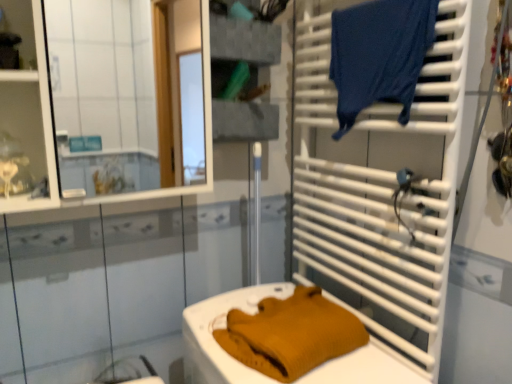
The image size is (512, 384). What do you see at coordinates (221, 328) in the screenshot?
I see `mustard knit sweater at lower center` at bounding box center [221, 328].

In order to click on white plastic towel rack at right in this screenshot , I will do `click(378, 190)`.

Image resolution: width=512 pixels, height=384 pixels. What do you see at coordinates (378, 190) in the screenshot? I see `white plastic towel rack at right` at bounding box center [378, 190].

The image size is (512, 384). Find the location of `matte white shelf at upper left, placed as the 2th shelf when sorted from right to left`. matte white shelf at upper left, placed as the 2th shelf when sorted from right to left is located at coordinates (20, 29).

Is dark blue fabric at upper right with mustard knit sweater at lower center?

No, dark blue fabric at upper right is not in contact with mustard knit sweater at lower center.

In the scene shown: From the image's perspective, who appears lower, dark blue fabric at upper right or mustard knit sweater at lower center?

mustard knit sweater at lower center, from the image's perspective.

Can you tell me how much dark blue fabric at upper right and mustard knit sweater at lower center differ in facing direction?

90 degrees.

Are white glossy mirror at upper left and mustard knit sweater at lower center located far from each other?

white glossy mirror at upper left is far away from mustard knit sweater at lower center.

Which object is wider, white glossy mirror at upper left or mustard knit sweater at lower center?

mustard knit sweater at lower center is wider.

There is a mustard knit sweater at lower center. Identify the location of mirror above it (from a real-world perspective). 131,96.

Which is correct: white plastic towel rack at right is inside dark blue fabric at upper right, or outside of it?

white plastic towel rack at right is not enclosed by dark blue fabric at upper right.

Can you confirm if white plastic towel rack at right is wider than dark blue fabric at upper right?

No.

Which object is further away from the camera, white plastic towel rack at right or dark blue fabric at upper right?

dark blue fabric at upper right is further from the camera.

Does textured gray fabric at upper center, marked as the 1th shelf in a back-to-front arrangement, have a lesser width compared to mustard knit sweater at lower center?

Correct, the width of textured gray fabric at upper center, marked as the 1th shelf in a back-to-front arrangement, is less than that of mustard knit sweater at lower center.

From the image's perspective, relative to mustard knit sweater at lower center, is textured gray fabric at upper center, positioned as the second shelf in front-to-back order, above or below?

Based on their image positions, textured gray fabric at upper center, positioned as the second shelf in front-to-back order, is located above mustard knit sweater at lower center.

In the scene shown: Which of these two, textured gray fabric at upper center, positioned as the second shelf in front-to-back order, or mustard knit sweater at lower center, is smaller?

With smaller size is textured gray fabric at upper center, positioned as the second shelf in front-to-back order.

Is matte white shelf at upper left, placed as the 2th shelf when sorted from right to left, a part of mustard knit sweater at lower center?

No.

Considering the sizes of objects mustard knit sweater at lower center and matte white shelf at upper left, placed as the 2th shelf when sorted from right to left, in the image provided, who is thinner, mustard knit sweater at lower center or matte white shelf at upper left, placed as the 2th shelf when sorted from right to left,?

Thinner between the two is matte white shelf at upper left, placed as the 2th shelf when sorted from right to left.

Does mustard knit sweater at lower center have a larger size compared to matte white shelf at upper left, which ranks as the 1th shelf in left-to-right order?

Correct, mustard knit sweater at lower center is larger in size than matte white shelf at upper left, which ranks as the 1th shelf in left-to-right order.

Which of these two, mustard knit sweater at lower center or matte white shelf at upper left, which ranks as the 1th shelf in left-to-right order, stands shorter?

matte white shelf at upper left, which ranks as the 1th shelf in left-to-right order, is shorter.

Which is less distant, (x=0, y=23) or (x=230, y=373)?

The point (x=230, y=373) is closer.

Is matte white shelf at upper left, placed as the 2th shelf when sorted from right to left, positioned with its back to mustard knit sweater at lower center?

That's not correct — matte white shelf at upper left, placed as the 2th shelf when sorted from right to left, is not looking away from mustard knit sweater at lower center.

From a real-world perspective, is matte white shelf at upper left, which ranks as the 1th shelf in left-to-right order, located higher than mustard knit sweater at lower center?

Yes, from a real-world perspective, matte white shelf at upper left, which ranks as the 1th shelf in left-to-right order, is over mustard knit sweater at lower center

From the image's perspective, which is above, matte white shelf at upper left, placed as the 2th shelf when sorted from right to left, or mustard knit sweater at lower center?

matte white shelf at upper left, placed as the 2th shelf when sorted from right to left, appears higher in the image.

From a real-world perspective, relative to white plastic towel rack at right, is white glossy mirror at upper left vertically above or below?

In terms of real-world spatial position, white glossy mirror at upper left is above white plastic towel rack at right.

Between white glossy mirror at upper left and white plastic towel rack at right, which one has larger width?

white glossy mirror at upper left is wider.

Does white glossy mirror at upper left have a smaller size compared to white plastic towel rack at right?

Actually, white glossy mirror at upper left might be larger than white plastic towel rack at right.

Is white plastic towel rack at right completely or partially inside white glossy mirror at upper left?

No, white glossy mirror at upper left does not contain white plastic towel rack at right.

You are a GUI agent. You are given a task and a screenshot of the screen. Output one action in this format:
    pyautogui.click(x=<x>, y=<y>)
    Task: Click on the laundry above the mustard knit sweater at lower center (from the image's perspective)
    The height and width of the screenshot is (384, 512).
    Given the screenshot: What is the action you would take?
    pyautogui.click(x=379, y=55)

Locate an element on the screen. Image resolution: width=512 pixels, height=384 pixels. mirror that is above the mustard knit sweater at lower center (from a real-world perspective) is located at coordinates (131, 96).

Based on their spatial positions, is white glossy mirror at upper left or dark blue fabric at upper right closer to textured gray fabric at upper center, marked as the 1th shelf in a back-to-front arrangement?

The object closer to textured gray fabric at upper center, marked as the 1th shelf in a back-to-front arrangement, is dark blue fabric at upper right.

Considering their positions, is white glossy mirror at upper left positioned further to matte white shelf at upper left, which is the 1th shelf in front-to-back order, than dark blue fabric at upper right?

white glossy mirror at upper left lies further to matte white shelf at upper left, which is the 1th shelf in front-to-back order, than the other object.

Based on their spatial positions, is dark blue fabric at upper right or white glossy mirror at upper left further from matte white shelf at upper left, acting as the second shelf starting from the back?

Based on the image, white glossy mirror at upper left appears to be further to matte white shelf at upper left, acting as the second shelf starting from the back.

Considering their positions, is textured gray fabric at upper center, marked as the 1th shelf in a back-to-front arrangement, positioned further to mustard knit sweater at lower center than white plastic towel rack at right?

Among the two, textured gray fabric at upper center, marked as the 1th shelf in a back-to-front arrangement, is located further to mustard knit sweater at lower center.

Looking at the image, which one is located closer to white glossy mirror at upper left, textured gray fabric at upper center, acting as the second shelf starting from the left, or white plastic towel rack at right?

textured gray fabric at upper center, acting as the second shelf starting from the left, lies closer to white glossy mirror at upper left than the other object.

Which object lies further to the anchor point white glossy mirror at upper left, white plastic towel rack at right or matte white shelf at upper left, placed as the 2th shelf when sorted from right to left?

matte white shelf at upper left, placed as the 2th shelf when sorted from right to left, lies further to white glossy mirror at upper left than the other object.

Based on their spatial positions, is matte white shelf at upper left, which ranks as the 1th shelf in left-to-right order, or mustard knit sweater at lower center further from white glossy mirror at upper left?

mustard knit sweater at lower center is further to white glossy mirror at upper left.

Looking at the image, which one is located further to dark blue fabric at upper right, white glossy mirror at upper left or textured gray fabric at upper center, positioned as the second shelf in front-to-back order?

Based on the image, white glossy mirror at upper left appears to be further to dark blue fabric at upper right.

Locate an element on the screen. The width and height of the screenshot is (512, 384). mirror that lies between matte white shelf at upper left, placed as the 2th shelf when sorted from right to left, and mustard knit sweater at lower center from top to bottom is located at coordinates (131, 96).

Find the location of a particular element. laundry positioned between white plastic towel rack at right and textured gray fabric at upper center, acting as the second shelf starting from the left, from near to far is located at coordinates (379, 55).

I want to click on laundry that lies between textured gray fabric at upper center, acting as the second shelf starting from the left, and mustard knit sweater at lower center from top to bottom, so click(x=379, y=55).

This screenshot has width=512, height=384. I want to click on mirror between textured gray fabric at upper center, marked as the 1th shelf in a back-to-front arrangement, and mustard knit sweater at lower center, in the vertical direction, so click(x=131, y=96).